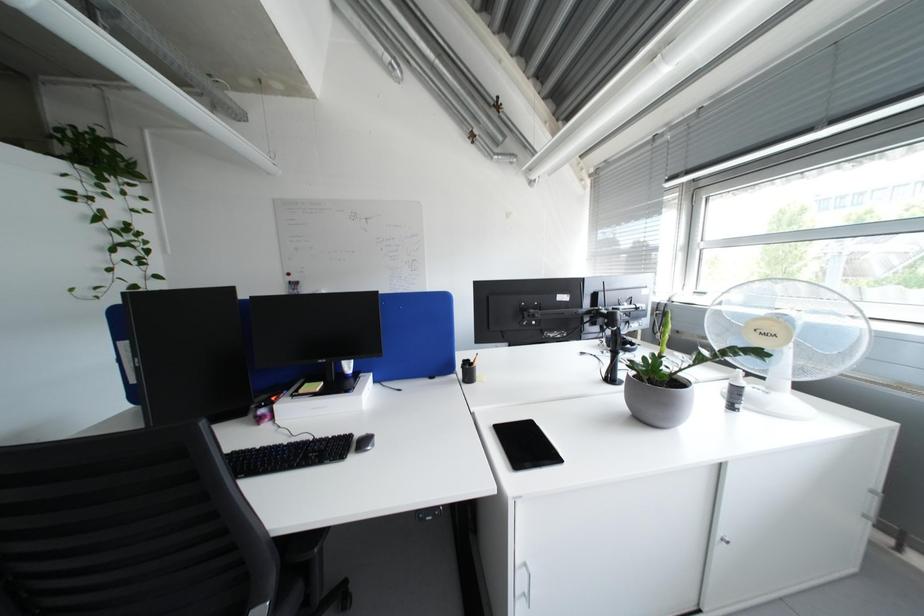
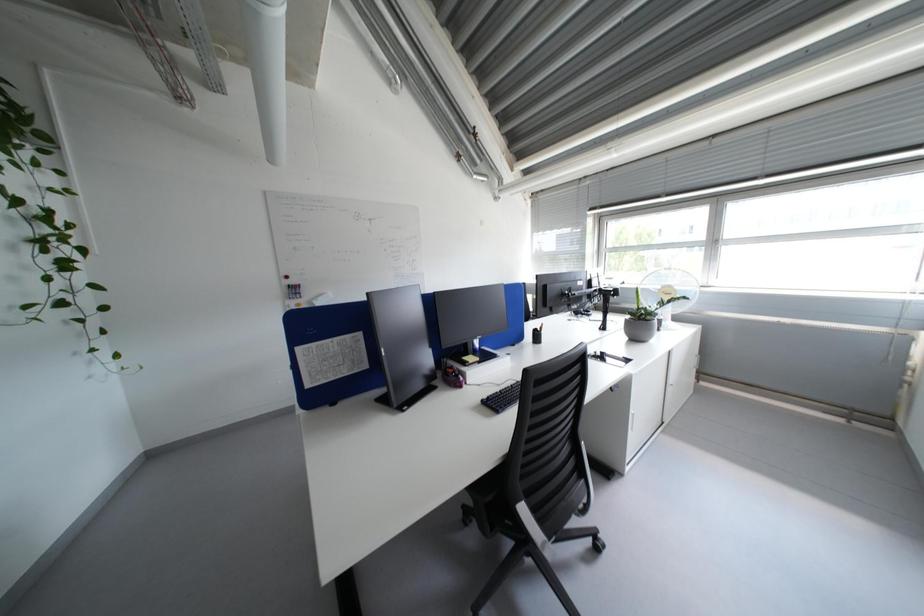
Question: What movement of the cameraman would produce the second image?

Choices:
 (A) Left
 (B) Right
 (C) Forward
 (D) Backward

Answer: (A)